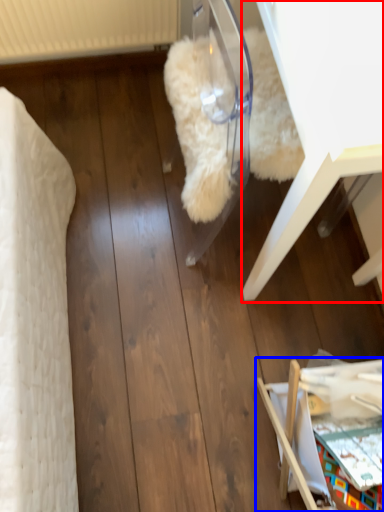
Question: Which point is closer to the camera, furniture (highlighted by a red box) or furniture (highlighted by a blue box)?

Choices:
 (A) furniture
 (B) furniture

Answer: (A)